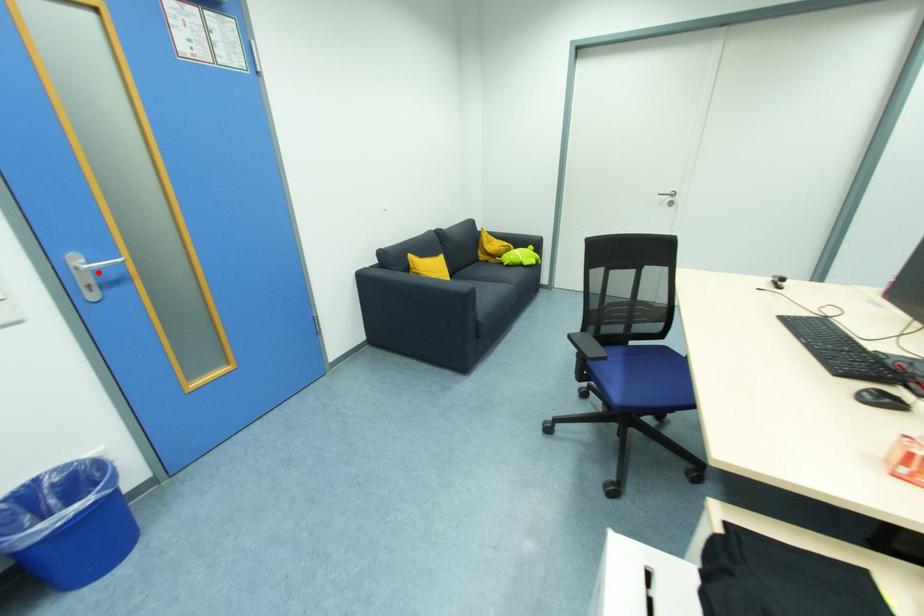
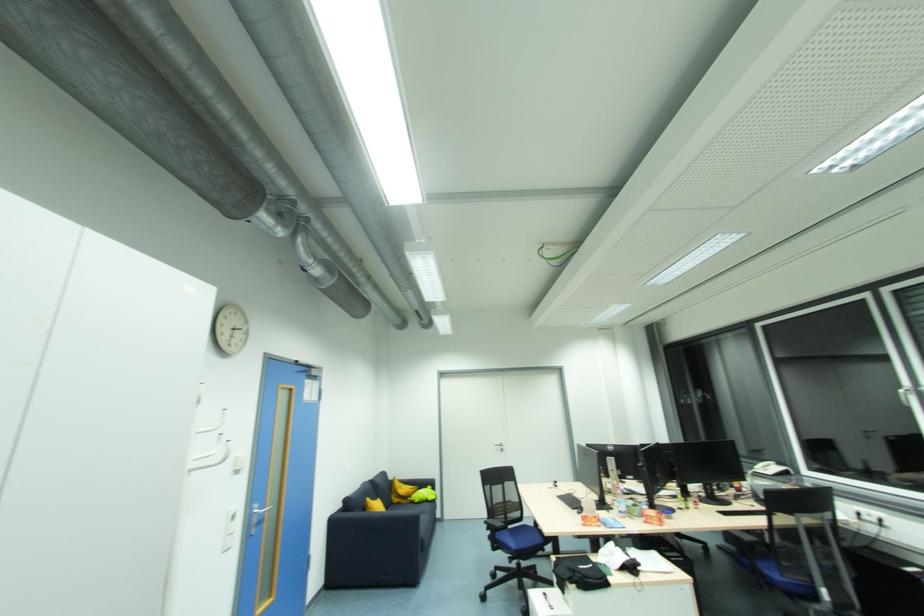
Locate, in the second image, the point that corresponds to the highlighted location in the first image.

(261, 517)